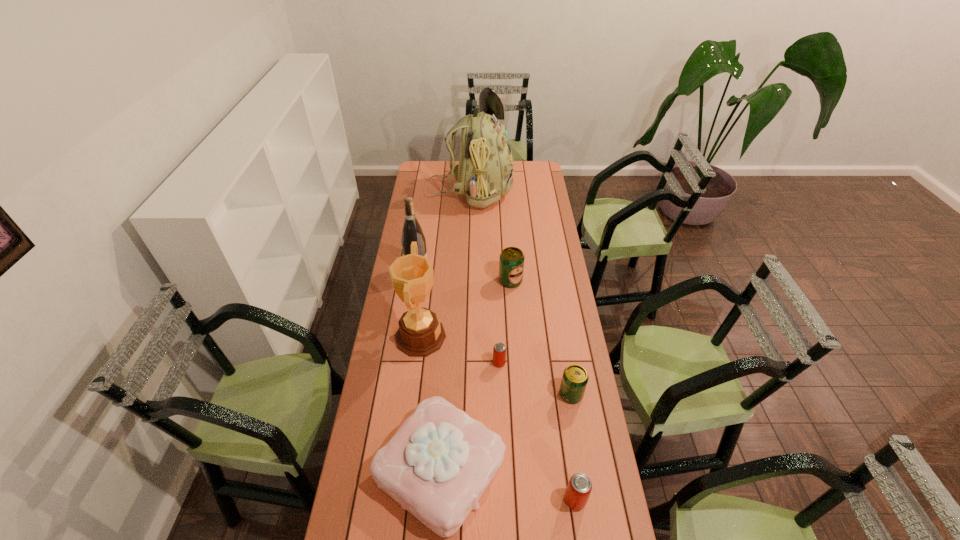
Identify the location of the shortest object. The height and width of the screenshot is (540, 960). (499, 351).

This screenshot has width=960, height=540. In order to click on the shortest beer can in this screenshot , I will do `click(499, 351)`.

This screenshot has width=960, height=540. I want to click on free space located on the front-facing side of the backpack, so click(x=544, y=192).

Identify the location of free space located 0.060m on the back of the wine bottle. This screenshot has width=960, height=540. (420, 255).

Find the location of a particular element. free point located 0.260m on the front-facing side of the award is located at coordinates (510, 337).

The width and height of the screenshot is (960, 540). Find the location of `free space located 0.200m on the back of the tallest beer can`. free space located 0.200m on the back of the tallest beer can is located at coordinates (508, 245).

Locate an element on the screen. This screenshot has width=960, height=540. vacant space located 0.250m on the back of the third farthest beer can is located at coordinates (561, 331).

Image resolution: width=960 pixels, height=540 pixels. Find the location of `vacant space located 0.140m on the left of the right pink beer can`. vacant space located 0.140m on the left of the right pink beer can is located at coordinates (517, 500).

At what (x,y) coordinates should I click in order to perform the action: click on vacant space positioned on the left of the farther pink beer can. Please return your answer as a coordinate pair (x, y). Looking at the image, I should click on (418, 363).

Locate an element on the screen. object that is at the far edge is located at coordinates (485, 171).